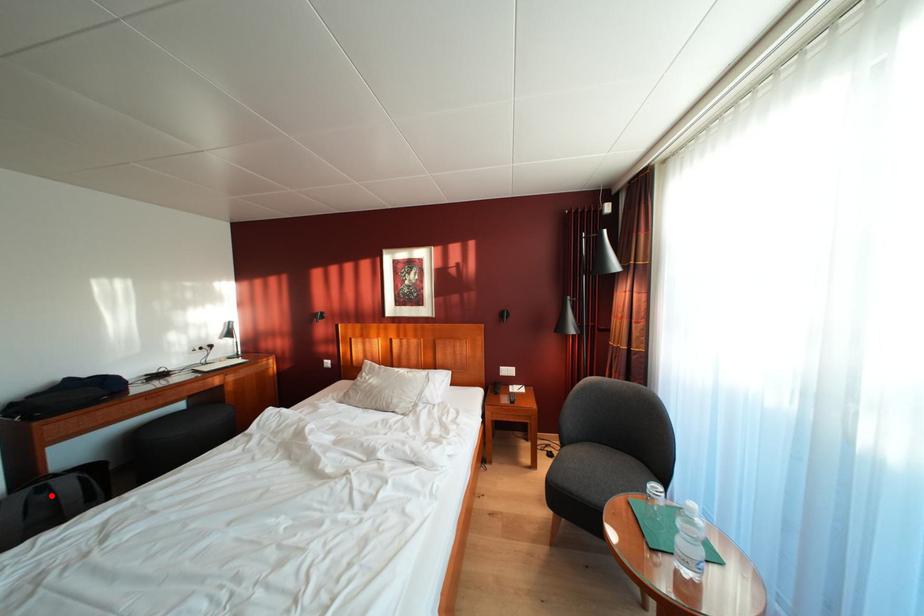
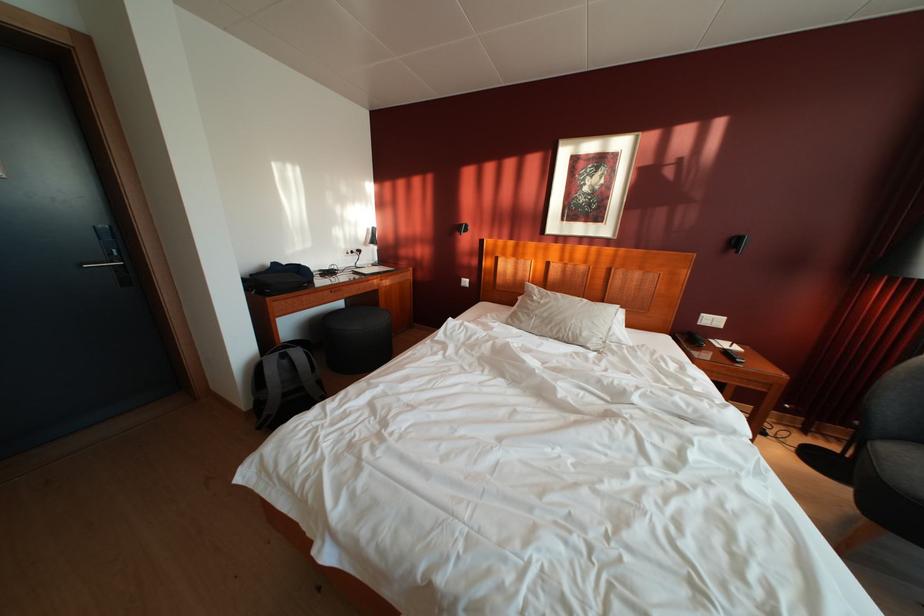
Locate, in the second image, the point that corresponds to the highlighted location in the first image.

(293, 362)